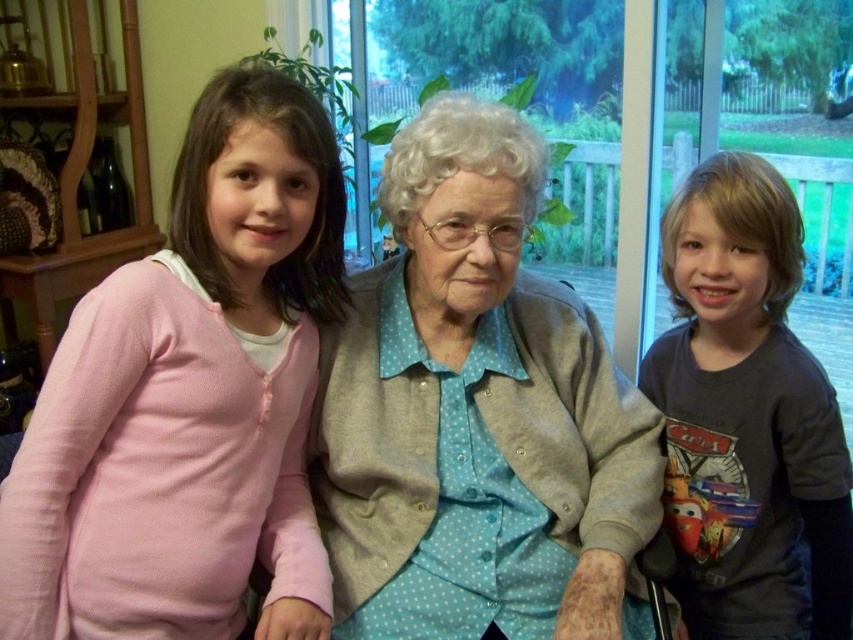
Question: Which object is positioned closest to the light blue dotted fabric at center?

Choices:
 (A) pink cotton sweater at left
 (B) dark gray t-shirt at right

Answer: (A)

Question: Where is light blue dotted fabric at center located in relation to dark gray t-shirt at right in the image?

Choices:
 (A) above
 (B) below

Answer: (A)

Question: Can you confirm if pink cotton sweater at left is positioned below dark gray t-shirt at right?

Choices:
 (A) yes
 (B) no

Answer: (B)

Question: Which object is closer to the camera taking this photo?

Choices:
 (A) dark gray t-shirt at right
 (B) pink cotton sweater at left

Answer: (B)

Question: Which object appears farthest from the camera in this image?

Choices:
 (A) dark gray t-shirt at right
 (B) light blue dotted fabric at center

Answer: (A)

Question: Is pink cotton sweater at left wider than light blue dotted fabric at center?

Choices:
 (A) no
 (B) yes

Answer: (A)